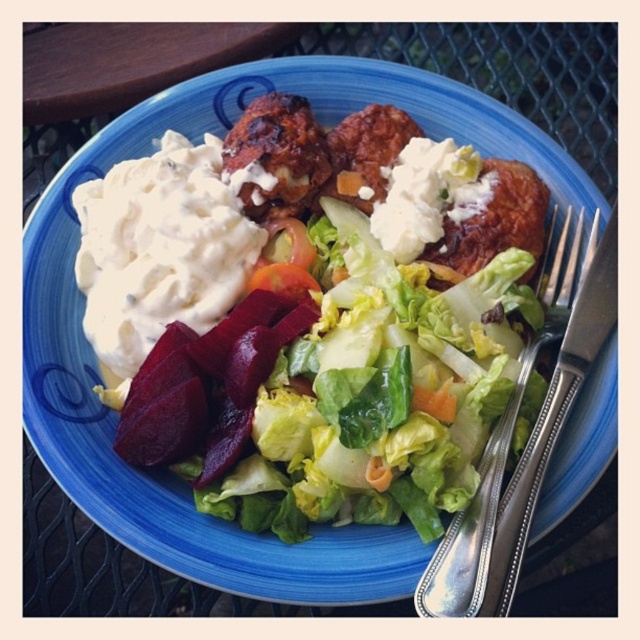
Question: Is brown crispy meatballs at upper center in front of orange smooth carrot at center?

Choices:
 (A) yes
 (B) no

Answer: (B)

Question: Among these points, which one is nearest to the camera?

Choices:
 (A) (424, 372)
 (B) (333, 157)
 (C) (260, 136)

Answer: (A)

Question: Which object is the farthest from the brown crispy meat at center?

Choices:
 (A) orange smooth-textured carrot at center
 (B) matte green lettuce at center

Answer: (A)

Question: Estimate the real-world distances between objects in this image. Which object is closer to the brown crispy meat at center?

Choices:
 (A) orange smooth-textured carrot at center
 (B) brown crispy meatballs at upper center

Answer: (B)

Question: Is silver plated fork at right positioned behind orange smooth carrot at center?

Choices:
 (A) yes
 (B) no

Answer: (B)

Question: Is brown crispy meat at center above orange smooth carrot at center?

Choices:
 (A) no
 (B) yes

Answer: (B)